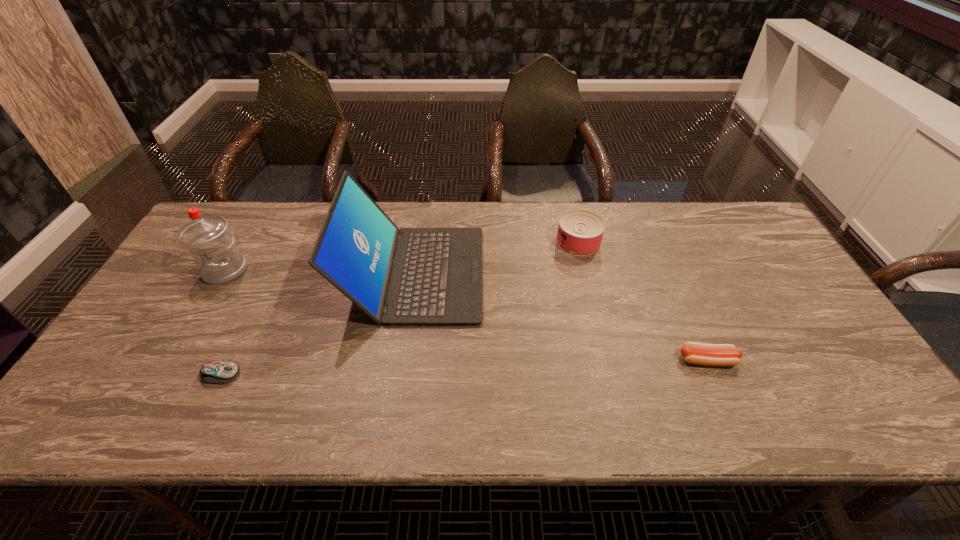
Where is `vacant space located on the back of the can`? vacant space located on the back of the can is located at coordinates (571, 212).

This screenshot has width=960, height=540. I want to click on vacant region located 0.090m on the back of the rightmost object, so click(690, 321).

Find the location of a particular element. vacant space situated 0.160m on the wheel side of the shortest object is located at coordinates (308, 375).

Find the location of a particular element. This screenshot has width=960, height=540. laptop computer situated at the far edge is located at coordinates (410, 276).

The width and height of the screenshot is (960, 540). Find the location of `can positioned at the far edge`. can positioned at the far edge is located at coordinates (580, 232).

Image resolution: width=960 pixels, height=540 pixels. What are the coordinates of `object at the left edge` in the screenshot? It's located at (207, 237).

The width and height of the screenshot is (960, 540). What are the coordinates of `free region at the far edge of the desktop` in the screenshot? It's located at (498, 205).

What are the coordinates of `vacant space at the near edge of the desktop` in the screenshot? It's located at (169, 428).

This screenshot has height=540, width=960. I want to click on vacant space at the left edge, so click(x=86, y=394).

Identify the location of vacant space at the right edge of the desktop. Image resolution: width=960 pixels, height=540 pixels. (762, 274).